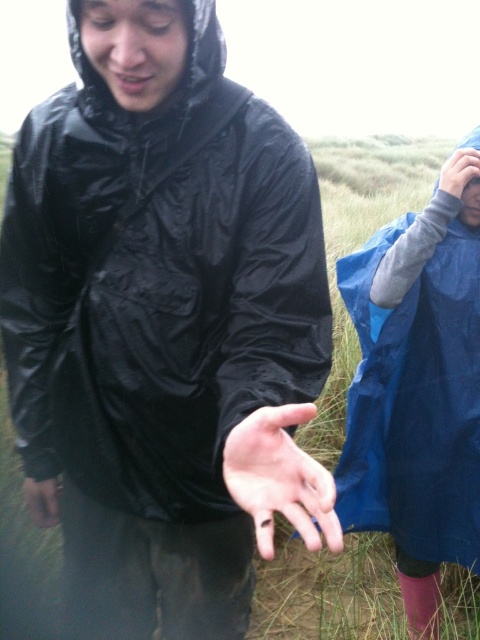
Who is shorter, black shiny jacket at center or blue waterproof jacket at right?

black shiny jacket at center is shorter.

Who is more forward, (75, 22) or (347, 422)?

Point (75, 22) is more forward.

Find the location of a particular element. This screenshot has height=640, width=480. black shiny jacket at center is located at coordinates (165, 289).

Does black shiny jacket at center have a smaller size compared to matte blue glove at right?

No, black shiny jacket at center is not smaller than matte blue glove at right.

Can you confirm if black shiny jacket at center is positioned to the right of matte blue glove at right?

In fact, black shiny jacket at center is to the left of matte blue glove at right.

Is point (116, 211) positioned behind point (458, 160)?

That is False.

This screenshot has height=640, width=480. I want to click on black shiny jacket at center, so click(x=165, y=289).

Describe the element at coordinates (279, 477) in the screenshot. I see `smooth skin palm at center` at that location.

Is smooth skin palm at center positioned before matte blue glove at right?

Yes.

You are a GUI agent. You are given a task and a screenshot of the screen. Output one action in this format:
    pyautogui.click(x=<x>, y=<y>)
    Task: Click on the smooth skin palm at center
    This screenshot has width=480, height=640.
    Given the screenshot: What is the action you would take?
    pyautogui.click(x=279, y=477)